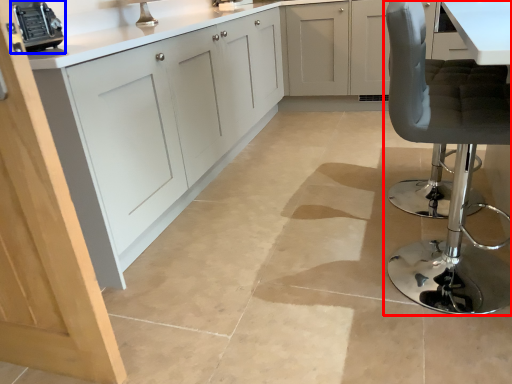
Question: Which object is closer to the camera taking this photo, chair (highlighted by a red box) or appliance (highlighted by a blue box)?

Choices:
 (A) chair
 (B) appliance

Answer: (A)